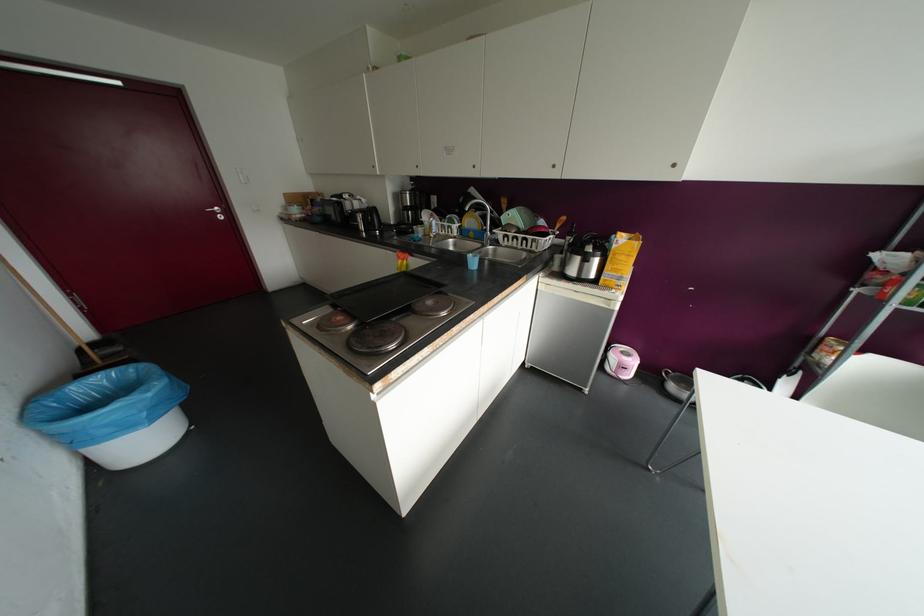
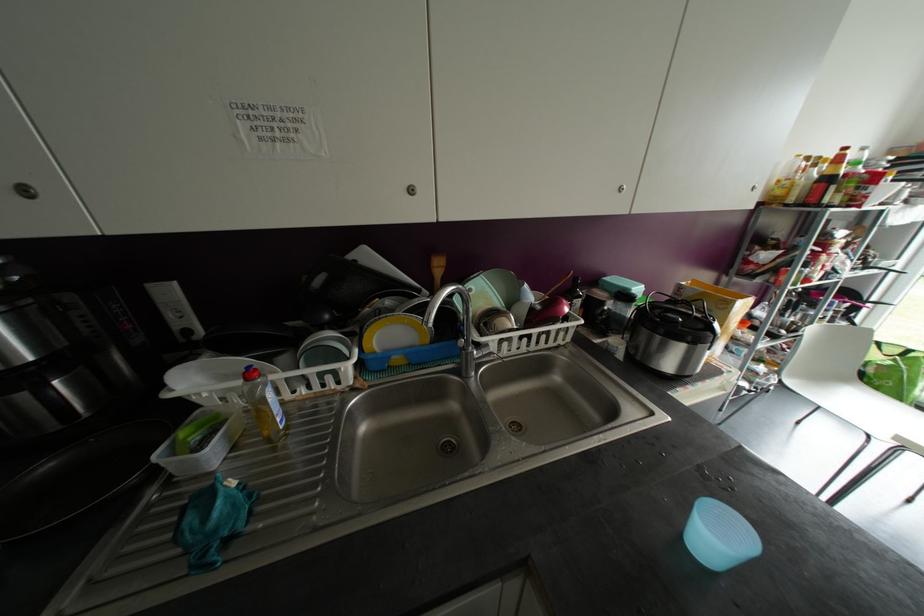
Locate, in the second image, the point that corresponds to pixel 434 236 in the first image.

(286, 427)